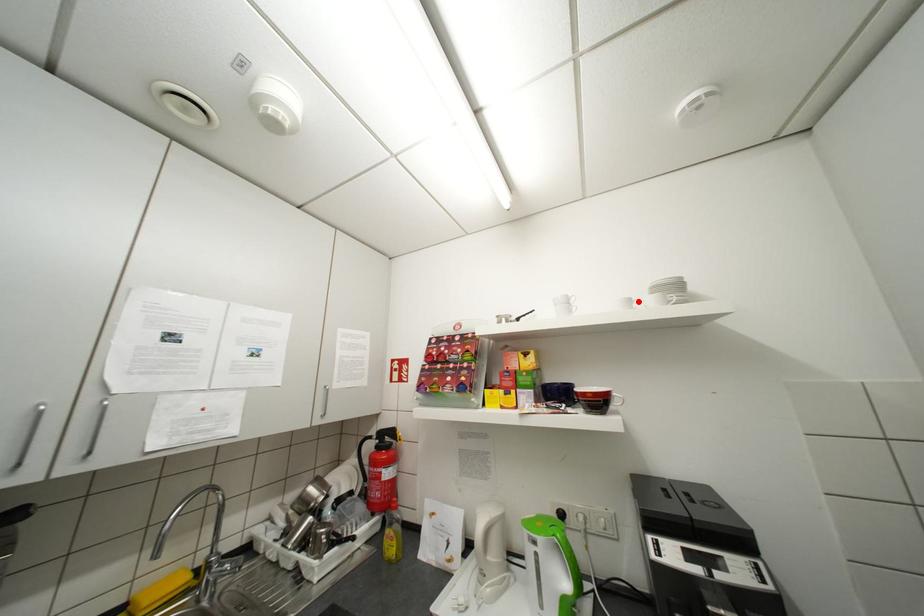
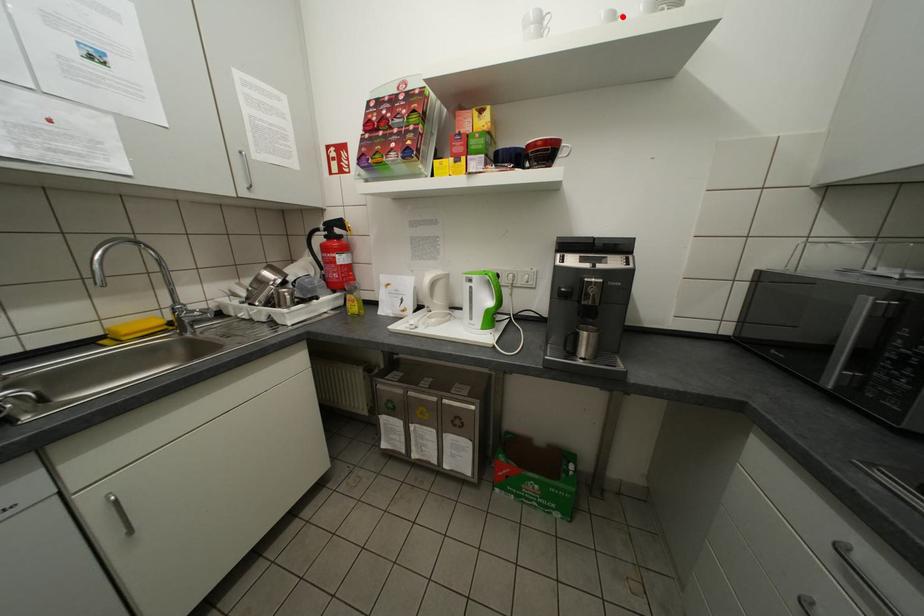
I am providing you with two images of the same scene from different viewpoints. A red point is marked on the first image and another point is marked on the second image. Are the points marked in image1 and image2 representing the same 3D position?

Yes